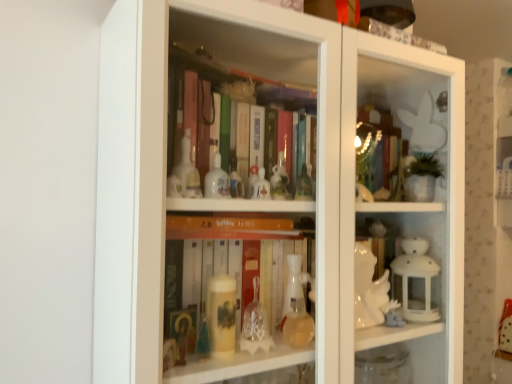
This screenshot has width=512, height=384. In order to click on white glass shelf at center in this screenshot , I will do `click(274, 200)`.

Describe the element at coordinates (274, 200) in the screenshot. I see `white glass shelf at center` at that location.

At what (x,y) coordinates should I click in order to perform the action: click on white glass shelf at center. Please return your answer as a coordinate pair (x, y). The width and height of the screenshot is (512, 384). Looking at the image, I should click on (274, 200).